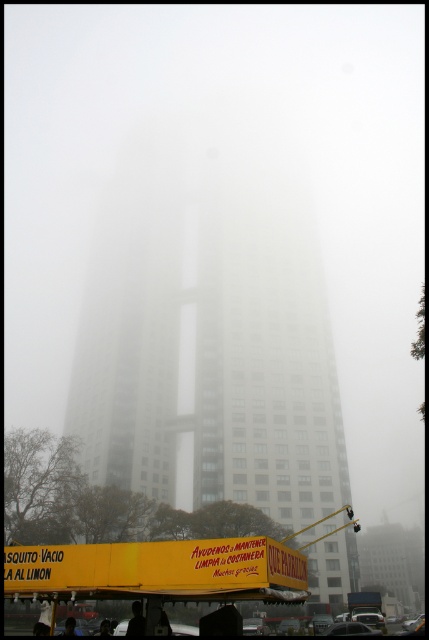
You are a delivery person trying to navigate through the foggy area. You see the white glass tower at center and the yellow matte food truck at lower center. Which object should you head towards if you need to reach the food truck first?

You should head towards the yellow matte food truck at lower center because the white glass tower at center is to the left of it, meaning the food truck is positioned to the right of the tower. Since you need to reach the food truck first, moving towards it directly would be the correct path.

You are a drone operator who needs to fly a drone from the yellow matte food truck at lower center to the white glass tower at center. Considering the foggy conditions, will the drone have a clear path to the tower?

The white glass tower at center is much taller than the yellow matte food truck at lower center, so the drone should have a clear path as there are no obstacles between them mentioned in the scene description.